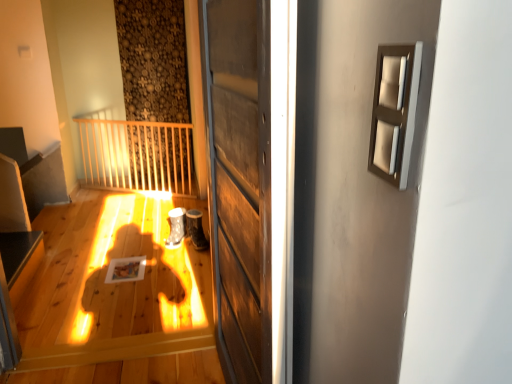
Question: Looking at their shapes, would you say smooth black surface at lower left is wider or thinner than satin beige frame at upper right?

Choices:
 (A) wide
 (B) thin

Answer: (A)

Question: Would you say smooth black surface at lower left is inside or outside satin beige frame at upper right?

Choices:
 (A) outside
 (B) inside

Answer: (A)

Question: Estimate the real-world distances between objects in this image. Which object is farther from the satin beige frame at upper right?

Choices:
 (A) smooth black surface at lower left
 (B) wooden door at center

Answer: (A)

Question: Estimate the real-world distances between objects in this image. Which object is farther from the wooden door at center?

Choices:
 (A) satin beige frame at upper right
 (B) smooth black surface at lower left

Answer: (B)